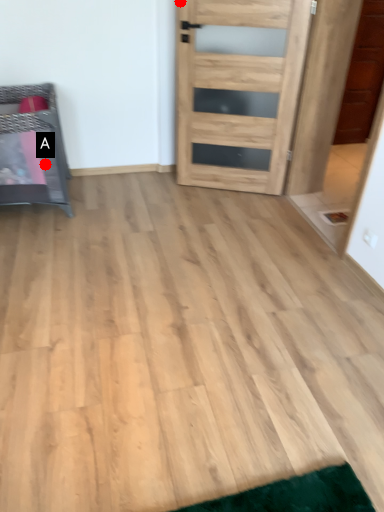
Question: Two points are circled on the image, labeled by A and B beside each circle. Which point is closer to the camera?

Choices:
 (A) A is closer
 (B) B is closer

Answer: (A)